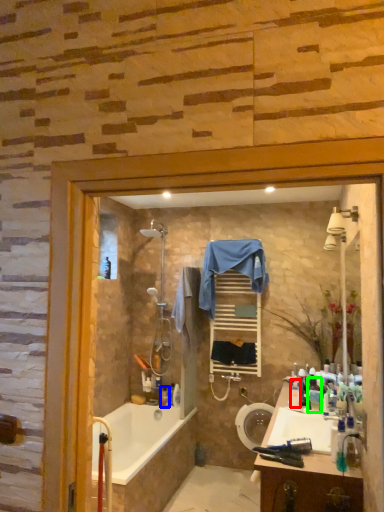
Question: Estimate the real-world distances between objects in this image. Which object is closer to toiletry (highlighted by a red box), toiletry (highlighted by a blue box) or toiletry (highlighted by a green box)?

Choices:
 (A) toiletry
 (B) toiletry

Answer: (B)